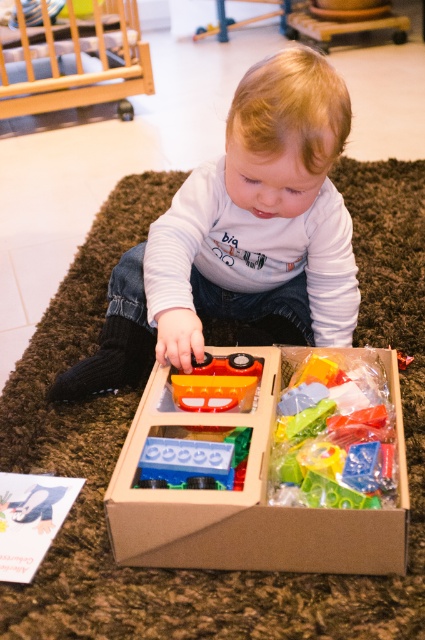
Does brown cardboard box at center have a lesser height compared to translucent plastic toy at center?

No.

Which is more to the right, brown cardboard box at center or translucent plastic toy at center?

translucent plastic toy at center is more to the right.

What are the coordinates of `brown cardboard box at center` in the screenshot? It's located at (248, 500).

Does smooth white shirt at center lie in front of translucent orange plastic toy car at center?

That is True.

Which is below, smooth white shirt at center or translucent orange plastic toy car at center?

translucent orange plastic toy car at center is lower down.

Between point (300, 336) and point (184, 406), which one is positioned in front?

Point (184, 406) is more forward.

This screenshot has width=425, height=640. Identify the location of smooth white shirt at center. (240, 236).

Does brown cardboard box at center have a smaller size compared to translucent orange plastic toy car at center?

Actually, brown cardboard box at center might be larger than translucent orange plastic toy car at center.

Who is more distant from viewer, (x=265, y=424) or (x=212, y=385)?

Positioned behind is point (x=212, y=385).

Find the location of a particular element. The image size is (425, 640). brown cardboard box at center is located at coordinates (248, 500).